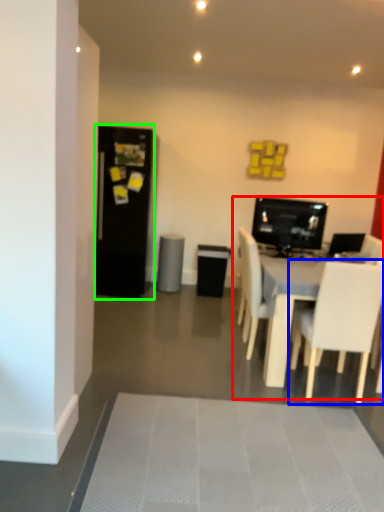
Question: Estimate the real-world distances between objects in this image. Which object is farther from entertainment center (highlighted by a red box), chair (highlighted by a blue box) or fridge (highlighted by a green box)?

Choices:
 (A) chair
 (B) fridge

Answer: (B)